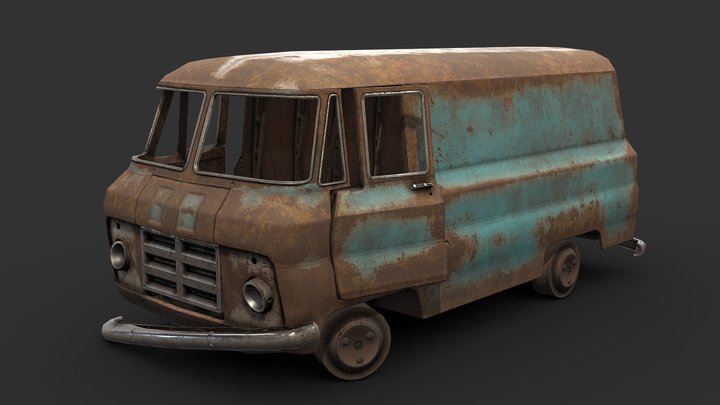
Where is `door handle`? The width and height of the screenshot is (720, 405). door handle is located at coordinates (420, 189).